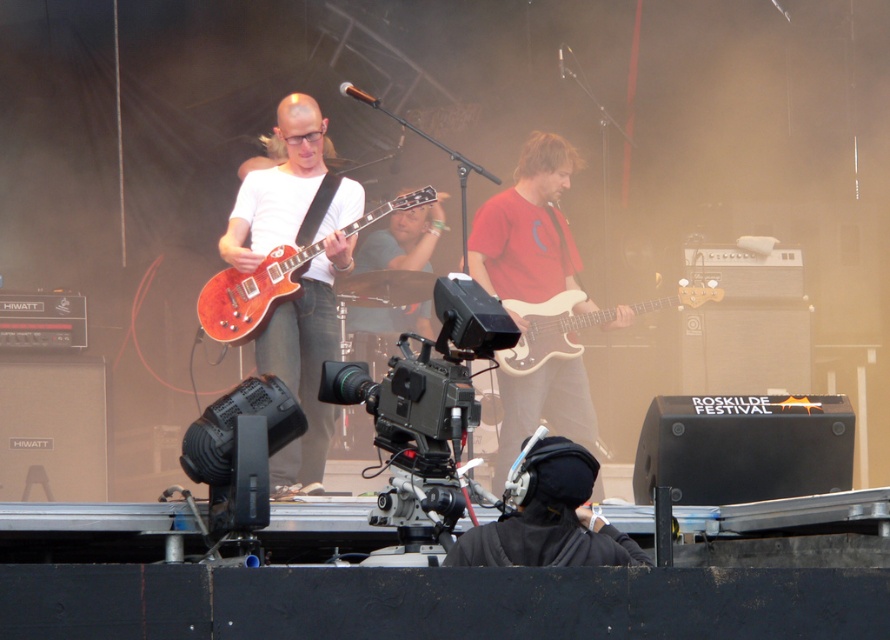
Between black matte headphones at center and glossy wood guitar at center, which one is positioned lower?

black matte headphones at center is below.

Consider the image. Between black matte headphones at center and glossy wood guitar at center, which one is positioned higher?

glossy wood guitar at center

Which is behind, point (534, 458) or point (281, 250)?

The point (281, 250) is more distant.

Where is `black matte headphones at center`? black matte headphones at center is located at coordinates (548, 515).

Between matte black guitar at center and glossy wood guitar at center, which one is positioned lower?

matte black guitar at center

Looking at this image, does matte black guitar at center appear under glossy wood guitar at center?

Correct, matte black guitar at center is located below glossy wood guitar at center.

What do you see at coordinates (301, 275) in the screenshot?
I see `matte black guitar at center` at bounding box center [301, 275].

Locate an element on the screen. The image size is (890, 640). matte black guitar at center is located at coordinates (301, 275).

Does glossy wood guitar at center have a lesser height compared to white matte bass guitar at center?

Yes.

Which of these two, glossy wood guitar at center or white matte bass guitar at center, stands taller?

white matte bass guitar at center is taller.

The width and height of the screenshot is (890, 640). What do you see at coordinates (252, 292) in the screenshot? I see `glossy wood guitar at center` at bounding box center [252, 292].

The image size is (890, 640). What are the coordinates of `glossy wood guitar at center` in the screenshot? It's located at (252, 292).